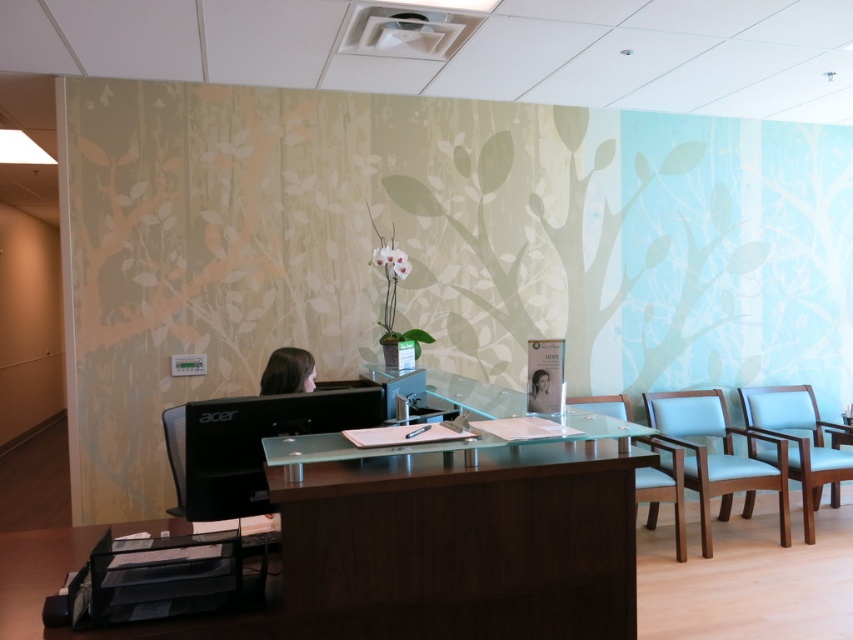
Based on the photo, you are an office manager planning to rearrange the reception area. You want to place a large potted fern that is 1.2 meters wide between the dark brown wood table at center and the light blue fabric armchair at right. Is there enough space between them to accommodate the fern?

The dark brown wood table at center occupies less space than the light blue fabric armchair at right. However, the exact distance between them isn t specified in the provided information. Without knowing the distance between the two objects, it s impossible to determine if the 1.2 meter wide fern will fit. More spatial details are needed to answer this question accurately.

From the picture: You are a visitor entering the reception area and need to sit down. You see the light blue fabric armchair at right and the light blue fabric chair at center. Which chair is closer to the reception desk?

The light blue fabric armchair at right is closer to the reception desk because the light blue fabric chair at center is behind it.